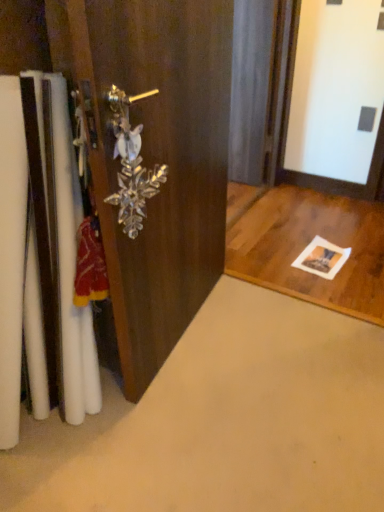
The image size is (384, 512). Find the location of `free location to the right of wooden door handle at left`. free location to the right of wooden door handle at left is located at coordinates (278, 346).